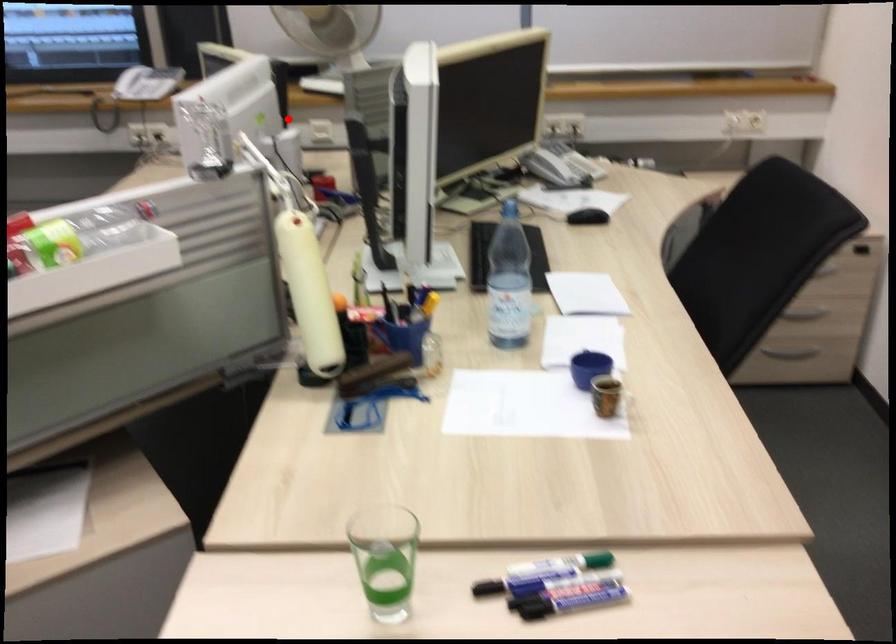
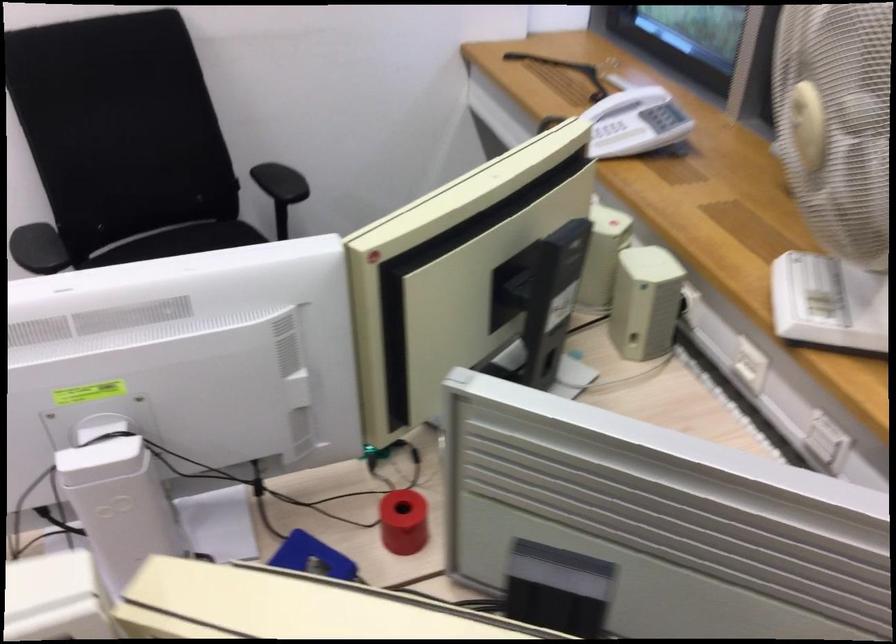
The point at the highlighted location is marked in the first image. Where is the corresponding point in the second image?

(644, 301)